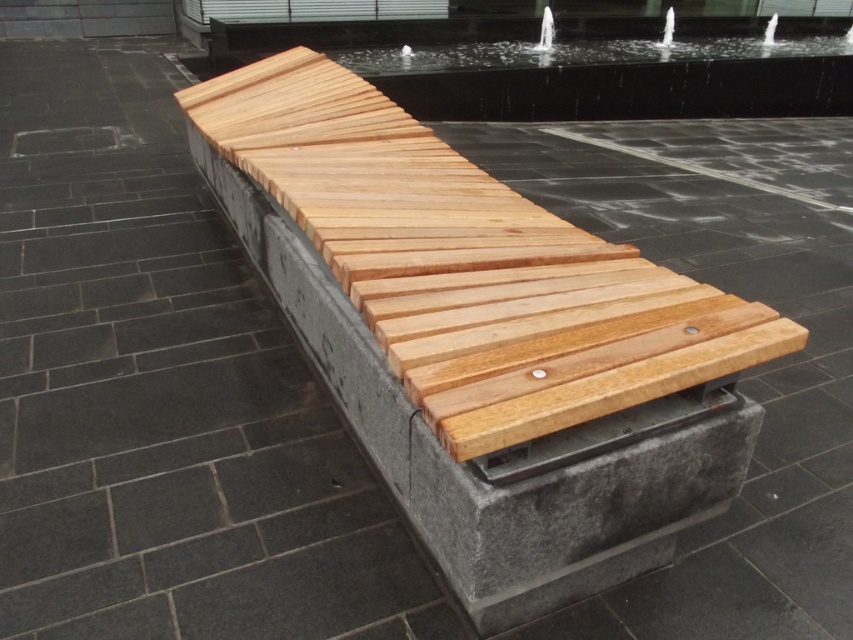
In the scene shown: Does natural wood bench at center lie in front of clear glass water at upper center?

Yes, it is in front of clear glass water at upper center.

Which is more to the left, natural wood bench at center or clear glass water at upper center?

natural wood bench at center

Is point (651, 556) closer to camera compared to point (548, 38)?

Yes, point (651, 556) is closer to viewer.

Find the location of `natural wood bench at center`. natural wood bench at center is located at coordinates (474, 337).